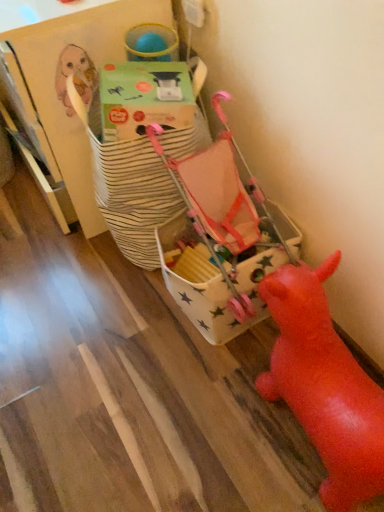
Where is `free space in front of white star-patterned fabric bag at center, which is the second toy in front-to-back order`? free space in front of white star-patterned fabric bag at center, which is the second toy in front-to-back order is located at coordinates (189, 396).